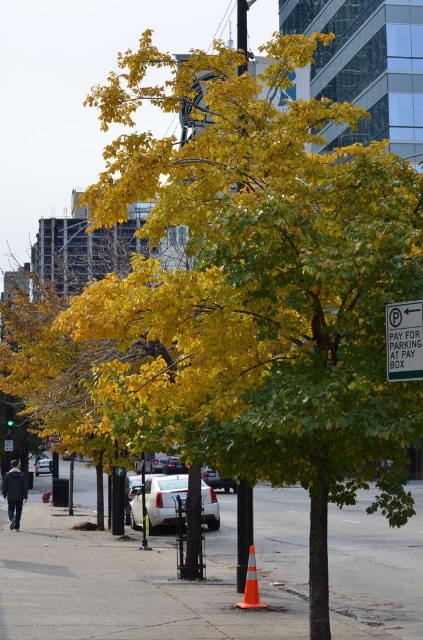
Is white plastic street sign at right further to camera compared to orange reflective traffic cone at center?

No, white plastic street sign at right is in front of orange reflective traffic cone at center.

How much distance is there between white plastic street sign at right and orange reflective traffic cone at center?

A distance of 6.64 meters exists between white plastic street sign at right and orange reflective traffic cone at center.

Between point (401, 321) and point (252, 572), which one is positioned behind?

The point (252, 572) is more distant.

Locate an element on the screen. white plastic street sign at right is located at coordinates (403, 340).

Does shiny silver sedan at center have a greater width compared to white plastic sign at upper center?

Indeed, shiny silver sedan at center has a greater width compared to white plastic sign at upper center.

Is shiny silver sedan at center thinner than white plastic sign at upper center?

No.

Which is in front, point (231, 477) or point (11, 449)?

Point (231, 477)

Where is `shiny silver sedan at center`? Image resolution: width=423 pixels, height=640 pixels. shiny silver sedan at center is located at coordinates (217, 481).

Is point (208, 472) positioned before point (36, 474)?

That is True.

Can you confirm if shiny silver sedan at center is smaller than white glossy sedan at center?

Incorrect, shiny silver sedan at center is not smaller in size than white glossy sedan at center.

Which is behind, point (211, 472) or point (47, 467)?

The point (47, 467) is more distant.

At what (x,y) coordinates should I click in order to perform the action: click on shiny silver sedan at center. Please return your answer as a coordinate pair (x, y). This screenshot has width=423, height=640. Looking at the image, I should click on (217, 481).